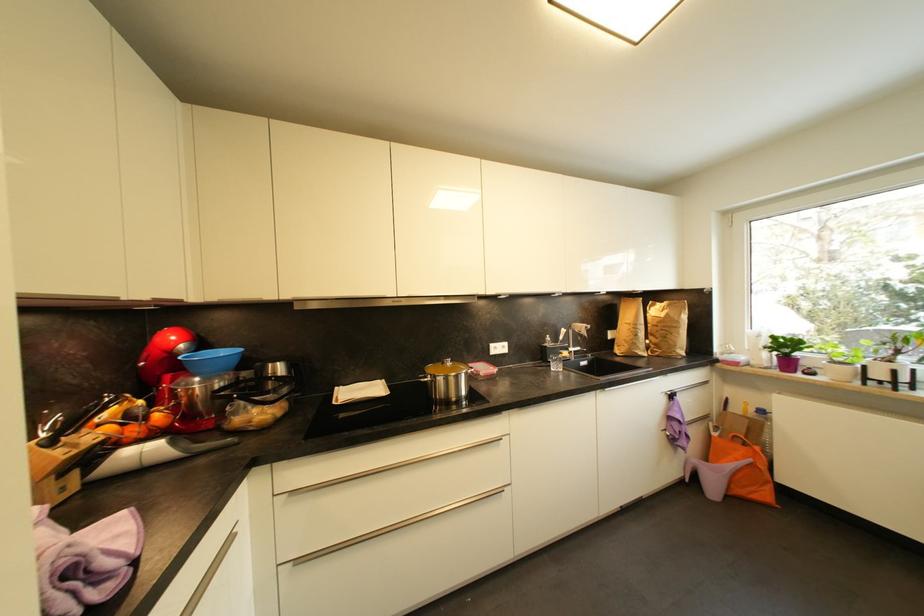
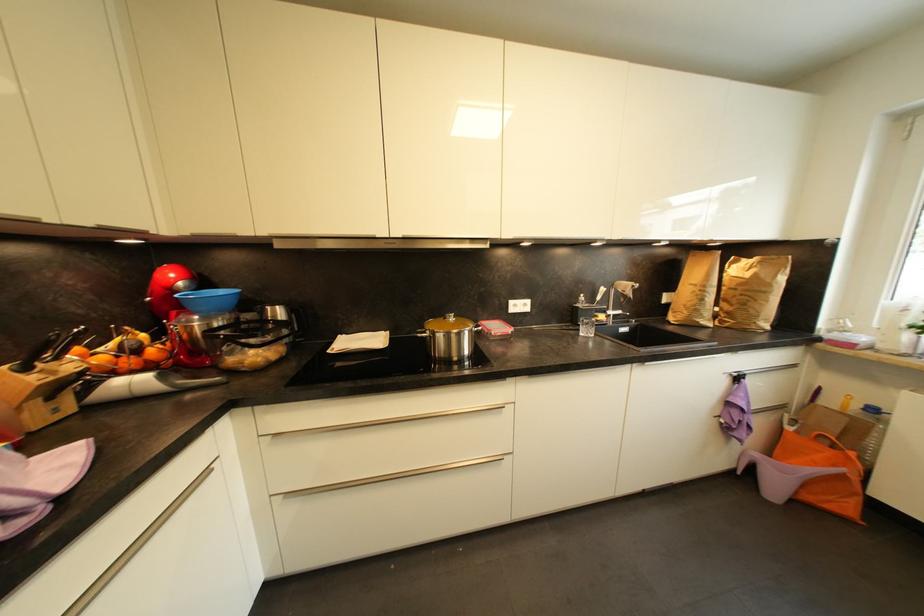
Question: The images are taken continuously from a first-person perspective. In which direction is your viewpoint rotating?

Choices:
 (A) Left
 (B) Right
 (C) Up
 (D) Down

Answer: (D)